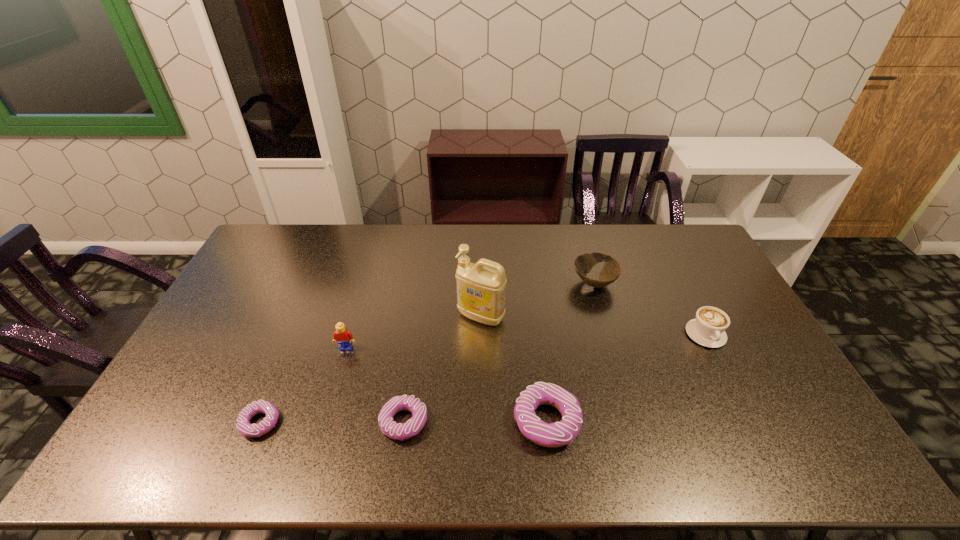
The width and height of the screenshot is (960, 540). I want to click on object located in the right edge section of the desktop, so click(708, 329).

Locate an element on the screen. This screenshot has height=540, width=960. blank space at the far edge is located at coordinates (567, 230).

You are a GUI agent. You are given a task and a screenshot of the screen. Output one action in this format:
    pyautogui.click(x=<x>, y=<y>)
    Task: Click on the vacant space at the near edge of the desktop
    This screenshot has width=960, height=540.
    Given the screenshot: What is the action you would take?
    pyautogui.click(x=278, y=403)

Identify the location of vacant space at the left edge. (232, 304).

What are the coordinates of `vacant space at the right edge of the desktop` in the screenshot? It's located at (708, 280).

At what (x,y) coordinates should I click in order to perform the action: click on blank area at the far right corner. Please return your answer as a coordinate pair (x, y). The image size is (960, 540). Looking at the image, I should click on point(669,261).

You are a GUI agent. You are given a task and a screenshot of the screen. Output one action in this format:
    pyautogui.click(x=<x>, y=<y>)
    Task: Click on the vacant area at the near right corner of the desktop
    
    Given the screenshot: What is the action you would take?
    pyautogui.click(x=781, y=397)

At what (x,y) coordinates should I click in order to perform the action: click on unoccupied position between the fourth object from right to left and the farthest object. Please return your answer as a coordinate pair (x, y). This screenshot has width=960, height=540. Looking at the image, I should click on (538, 300).

Image resolution: width=960 pixels, height=540 pixels. I want to click on free area in between the shortest doughnut and the fourth object from right to left, so (371, 369).

You are a GUI agent. You are given a task and a screenshot of the screen. Output one action in this format:
    pyautogui.click(x=<x>, y=<y>)
    Task: Click on the vacant area that lies between the Lego and the rightmost doughnut
    
    Given the screenshot: What is the action you would take?
    pyautogui.click(x=446, y=384)